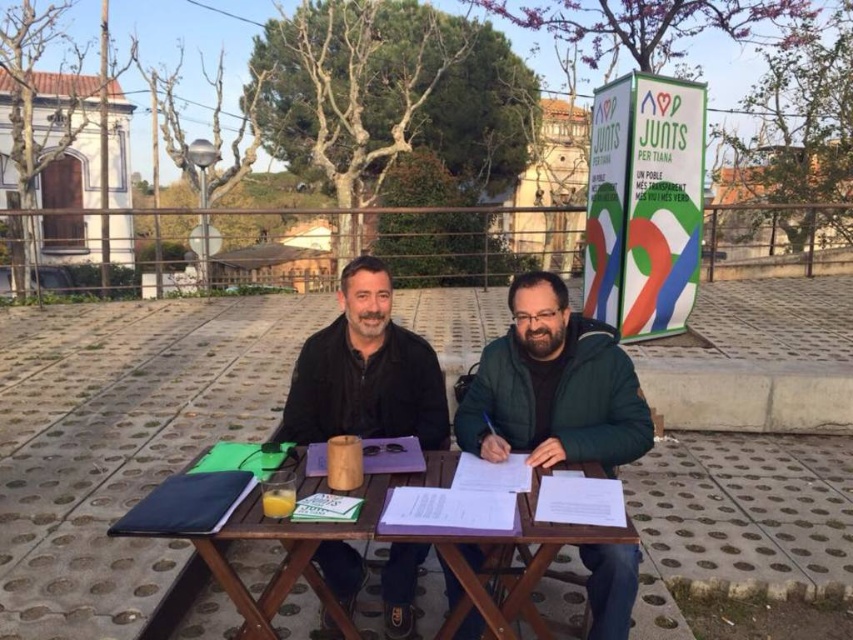
From the picture: You are a delivery person who needs to place a 15 inch wide package between the green matte jacket at center and the wooden picnic table at center. Can you fit the package in the space between them?

The space between the green matte jacket at center and the wooden picnic table at center is 18.26 inches. Since the package is 15 inches wide, it can fit in the space between them as there is enough room.

You are a delivery person who needs to place a 20 inch wide package on the wooden picnic table at center. The black matte jacket at center is currently occupying space near the table. Can you fit the package on the table without moving the jacket?

The distance between the wooden picnic table at center and the black matte jacket at center is 19.02 inches. Since the package is 20 inches wide, it is slightly wider than the available space between them. Therefore, you would need to move the jacket to accommodate the package.

You are trying to decide whether to place a thick book on the green matte jacket at center or the wooden picnic table at center. Which surface is more suitable based on their thickness?

The wooden picnic table at center is thicker than the green matte jacket at center, so placing the thick book on the wooden picnic table at center would be more suitable.